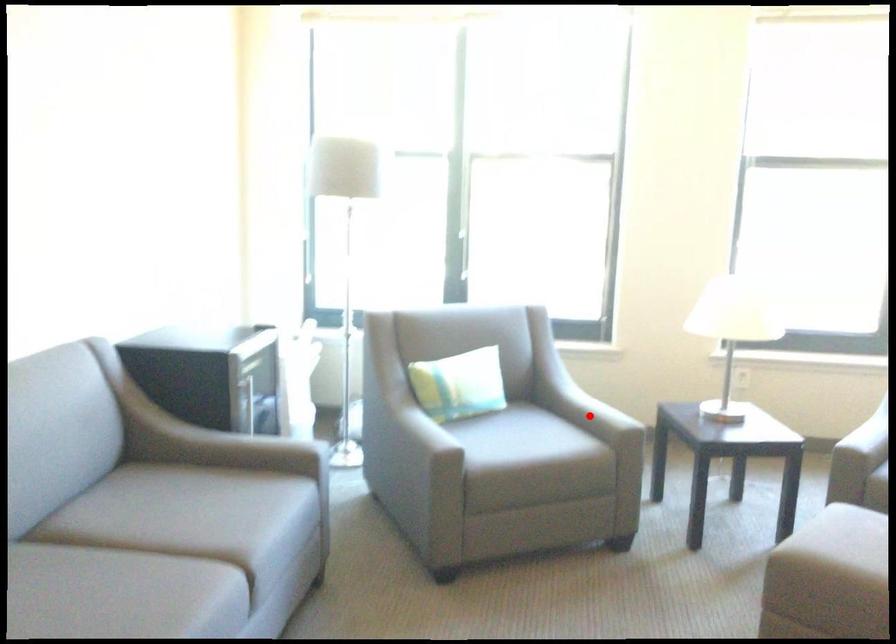
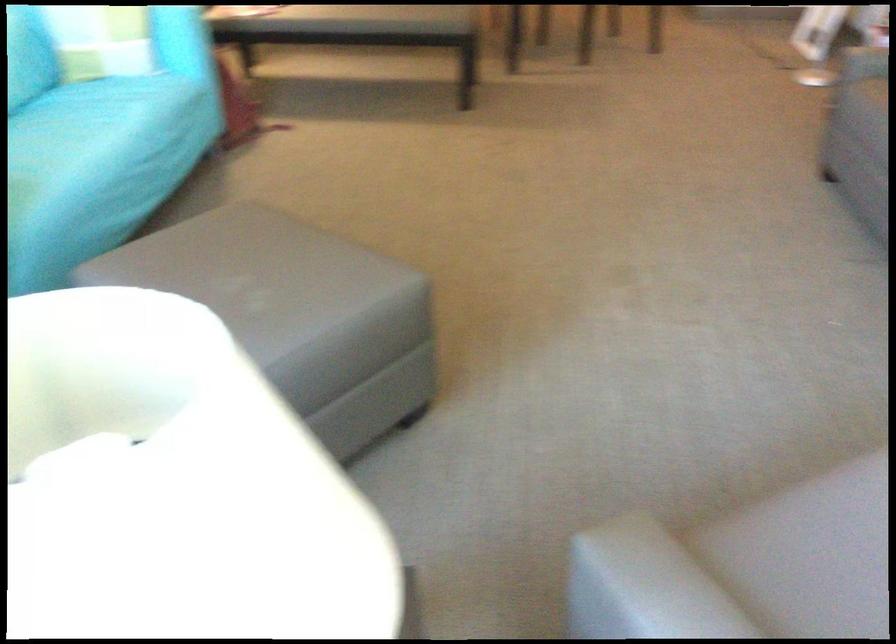
Question: A red point is marked in image1. In image2, is the corresponding 3D point closer to the camera or farther? Reply with the corresponding letter.

Choices:
 (A) The corresponding 3D point is closer.
 (B) The corresponding 3D point is farther.

Answer: (A)